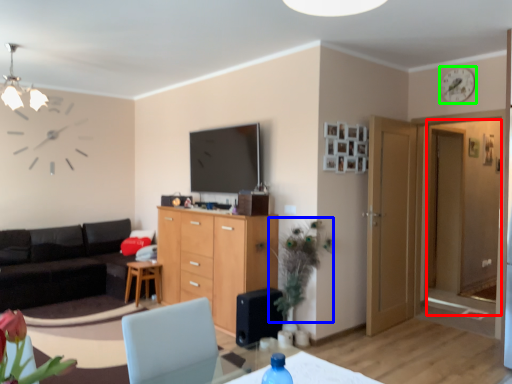
Question: Which is farther away from glass door (highlighted by a red box)? floral arrangement (highlighted by a blue box) or clock (highlighted by a green box)?

Choices:
 (A) floral arrangement
 (B) clock

Answer: (A)